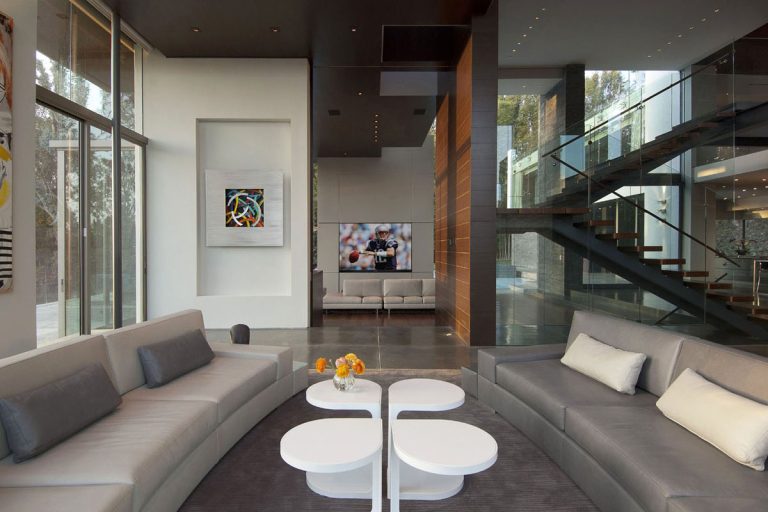
You are a GUI agent. You are given a task and a screenshot of the screen. Output one action in this format:
    pyautogui.click(x=<x>, y=<y>)
    Task: Click on the ceiling
    
    Given the screenshot: What is the action you would take?
    pyautogui.click(x=578, y=23), pyautogui.click(x=310, y=14)